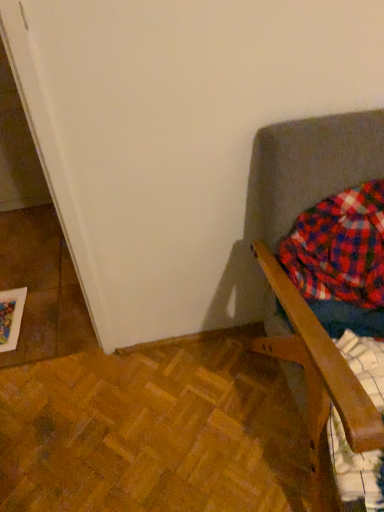
Question: Can you confirm if wooden chair at right is shorter than flannel plaid shirt at right?

Choices:
 (A) no
 (B) yes

Answer: (A)

Question: Is wooden chair at right at the left side of flannel plaid shirt at right?

Choices:
 (A) yes
 (B) no

Answer: (B)

Question: Considering the relative sizes of wooden chair at right and flannel plaid shirt at right in the image provided, is wooden chair at right taller than flannel plaid shirt at right?

Choices:
 (A) no
 (B) yes

Answer: (B)

Question: Does wooden chair at right appear on the right side of flannel plaid shirt at right?

Choices:
 (A) yes
 (B) no

Answer: (A)

Question: Is the depth of wooden chair at right less than that of flannel plaid shirt at right?

Choices:
 (A) no
 (B) yes

Answer: (B)

Question: Is the surface of wooden chair at right in direct contact with flannel plaid shirt at right?

Choices:
 (A) no
 (B) yes

Answer: (A)

Question: Is flannel plaid shirt at right surrounding wooden chair at right?

Choices:
 (A) yes
 (B) no

Answer: (B)

Question: From a real-world perspective, is flannel plaid shirt at right on wooden chair at right?

Choices:
 (A) yes
 (B) no

Answer: (A)

Question: Can you confirm if flannel plaid shirt at right is wider than wooden chair at right?

Choices:
 (A) yes
 (B) no

Answer: (B)

Question: Can you confirm if flannel plaid shirt at right is taller than wooden chair at right?

Choices:
 (A) yes
 (B) no

Answer: (B)

Question: Does flannel plaid shirt at right lie in front of wooden chair at right?

Choices:
 (A) no
 (B) yes

Answer: (A)

Question: From a real-world perspective, is flannel plaid shirt at right under wooden chair at right?

Choices:
 (A) no
 (B) yes

Answer: (A)

Question: From a real-world perspective, is flannel plaid shirt at right physically located above or below wooden chair at right?

Choices:
 (A) above
 (B) below

Answer: (A)